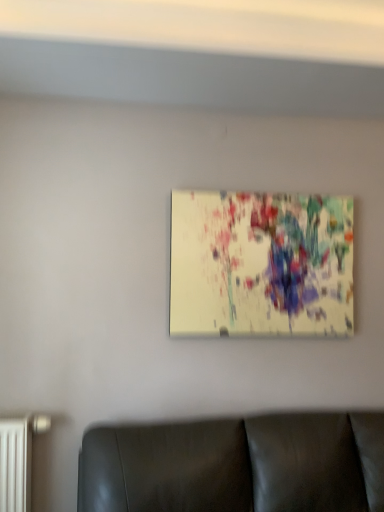
Question: From the image's perspective, relative to matte canvas painting at center, is black leather couch at lower center above or below?

Choices:
 (A) below
 (B) above

Answer: (A)

Question: Is point (157, 438) closer or farther from the camera than point (342, 274)?

Choices:
 (A) closer
 (B) farther

Answer: (A)

Question: Is black leather couch at lower center inside the boundaries of matte canvas painting at center, or outside?

Choices:
 (A) outside
 (B) inside

Answer: (A)

Question: In terms of size, does matte canvas painting at center appear bigger or smaller than black leather couch at lower center?

Choices:
 (A) small
 (B) big

Answer: (A)

Question: Visually, is matte canvas painting at center positioned to the left or to the right of black leather couch at lower center?

Choices:
 (A) right
 (B) left

Answer: (A)

Question: Which is correct: matte canvas painting at center is inside black leather couch at lower center, or outside of it?

Choices:
 (A) inside
 (B) outside

Answer: (B)

Question: Considering the positions of point (271, 281) and point (185, 461), is point (271, 281) closer or farther from the camera than point (185, 461)?

Choices:
 (A) closer
 (B) farther

Answer: (B)